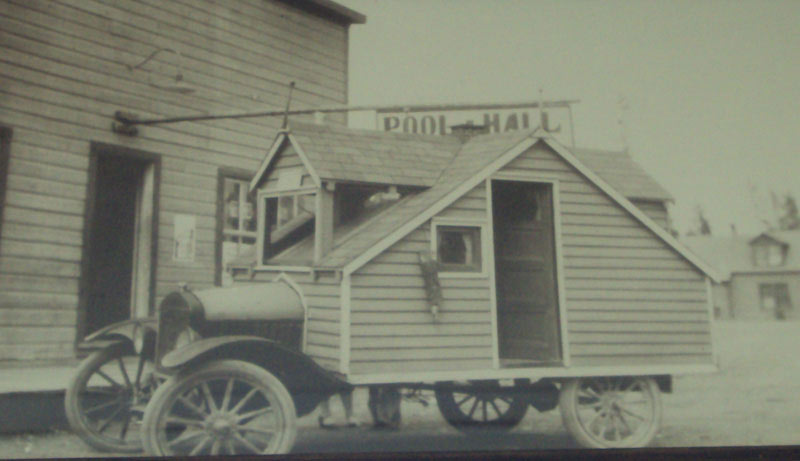
The image size is (800, 461). Find the location of `paper posted on wall next to door`. paper posted on wall next to door is located at coordinates (190, 241).